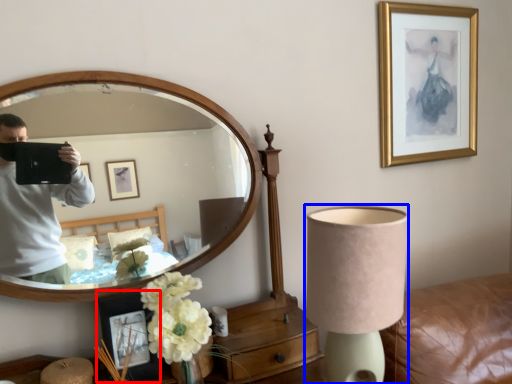
Question: Which point is further to the camera, picture frame (highlighted by a red box) or lamp (highlighted by a blue box)?

Choices:
 (A) picture frame
 (B) lamp

Answer: (A)